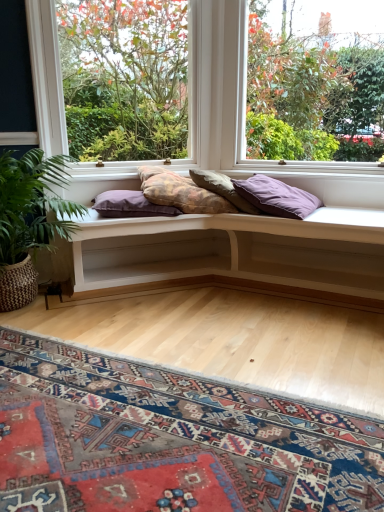
How much space does purple matte pillow at center, marked as the fourth pillow in a left-to-right arrangement, occupy vertically?

13.36 inches.

The height and width of the screenshot is (512, 384). Identify the location of textured purple pillow at center, the third pillow positioned from the right. (180, 192).

Describe the element at coordinates (229, 257) in the screenshot. I see `white wood bench at center` at that location.

Identify the location of textured beige pillow at center, acting as the second pillow starting from the right. (222, 189).

Where is `purple matte pillow at center, acting as the first pillow starting from the right`? purple matte pillow at center, acting as the first pillow starting from the right is located at coordinates (276, 197).

Does purple matte pillow at center, acting as the first pillow starting from the right, touch clear glass window at center, which is the 2th window in right-to-left order?

No.

Could you tell me if purple matte pillow at center, acting as the first pillow starting from the right, is facing clear glass window at center, which is the 1th window in left-to-right order?

No.

Would you say purple matte pillow at center, marked as the fourth pillow in a left-to-right arrangement, is outside clear glass window at center, which is the 1th window in left-to-right order?

purple matte pillow at center, marked as the fourth pillow in a left-to-right arrangement, lies outside clear glass window at center, which is the 1th window in left-to-right order,'s area.

Who is more distant, purple matte pillow at center, marked as the fourth pillow in a left-to-right arrangement, or clear glass window at center, which is the 1th window in left-to-right order?

clear glass window at center, which is the 1th window in left-to-right order, is behind.

Is point (99, 281) positioned after point (192, 426)?

Yes, it is behind point (192, 426).

Is white wood bench at center aimed at carpeted mat at lower center?

Yes, white wood bench at center faces towards carpeted mat at lower center.

Image resolution: width=384 pixels, height=512 pixels. I want to click on mat in front of the white wood bench at center, so click(x=169, y=440).

Which object is wider, white wood bench at center or carpeted mat at lower center?

carpeted mat at lower center is wider.

From the picture: From the image's perspective, is textured purple pillow at center, the third pillow positioned from the right, located beneath white wood bench at center?

No, from the image's perspective, textured purple pillow at center, the third pillow positioned from the right, is not beneath white wood bench at center.

Is textured purple pillow at center, the third pillow positioned from the right, oriented towards white wood bench at center?

No, textured purple pillow at center, the third pillow positioned from the right, is not oriented towards white wood bench at center.

Would you say textured purple pillow at center, which ranks as the 2th pillow in left-to-right order, is to the left or to the right of white wood bench at center in the picture?

Clearly, textured purple pillow at center, which ranks as the 2th pillow in left-to-right order, is on the left of white wood bench at center in the image.

Measure the distance from textured purple pillow at center, which ranks as the 2th pillow in left-to-right order, to white wood bench at center.

15.96 inches.

Considering the sizes of clear glass window at center, which is the 1th window in left-to-right order, and carpeted mat at lower center in the image, is clear glass window at center, which is the 1th window in left-to-right order, bigger or smaller than carpeted mat at lower center?

Clearly, clear glass window at center, which is the 1th window in left-to-right order, is larger in size than carpeted mat at lower center.

How far apart are clear glass window at center, which is the 1th window in left-to-right order, and carpeted mat at lower center?

A distance of 3.91 meters exists between clear glass window at center, which is the 1th window in left-to-right order, and carpeted mat at lower center.

How different are the orientations of clear glass window at center, which is the 1th window in left-to-right order, and carpeted mat at lower center in degrees?

40.9 degrees.

Between clear glass window at center, which is the 2th window in right-to-left order, and carpeted mat at lower center, which one appears on the right side from the viewer's perspective?

carpeted mat at lower center.

Considering the sizes of objects purple fabric pillow at center, the first pillow from the left, and white wood bench at center in the image provided, who is thinner, purple fabric pillow at center, the first pillow from the left, or white wood bench at center?

purple fabric pillow at center, the first pillow from the left.

Which is more distant, (158, 210) or (106, 229)?

The point (158, 210) is farther.

How many degrees apart are the facing directions of purple fabric pillow at center, placed as the fourth pillow when sorted from right to left, and white wood bench at center?

purple fabric pillow at center, placed as the fourth pillow when sorted from right to left, and white wood bench at center are facing 35.8 degrees away from each other.

How distant is purple fabric pillow at center, the first pillow from the left, from white wood bench at center?

They are 18.09 inches apart.

From a real-world perspective, is textured beige pillow at center, acting as the second pillow starting from the right, positioned above or below purple matte pillow at center, acting as the first pillow starting from the right?

textured beige pillow at center, acting as the second pillow starting from the right, is above purple matte pillow at center, acting as the first pillow starting from the right.

From the image's perspective, is textured beige pillow at center, acting as the second pillow starting from the right, under purple matte pillow at center, acting as the first pillow starting from the right?

Actually, textured beige pillow at center, acting as the second pillow starting from the right, appears above purple matte pillow at center, acting as the first pillow starting from the right, in the image.

Who is taller, textured beige pillow at center, the 3th pillow when ordered from left to right, or purple matte pillow at center, marked as the fourth pillow in a left-to-right arrangement?

purple matte pillow at center, marked as the fourth pillow in a left-to-right arrangement, is taller.

Which is behind, point (233, 198) or point (269, 181)?

The point (269, 181) is farther from the camera.

Is white wood bench at center turned away from textured beige pillow at center, acting as the second pillow starting from the right?

white wood bench at center is not turned away from textured beige pillow at center, acting as the second pillow starting from the right.

I want to click on table below the textured beige pillow at center, acting as the second pillow starting from the right (from a real-world perspective), so click(229, 257).

From a real-world perspective, who is located lower, white wood bench at center or textured beige pillow at center, the 3th pillow when ordered from left to right?

white wood bench at center.

From the image's perspective, would you say white wood bench at center is positioned over textured beige pillow at center, the 3th pillow when ordered from left to right?

No.

Locate an element on the screen. The height and width of the screenshot is (512, 384). window on the left of the purple matte pillow at center, marked as the fourth pillow in a left-to-right arrangement is located at coordinates (46, 75).

You are a GUI agent. You are given a task and a screenshot of the screen. Output one action in this format:
    pyautogui.click(x=<x>, y=<y>)
    Task: Click on the table on the right of the carpeted mat at lower center
    The image size is (384, 512).
    Given the screenshot: What is the action you would take?
    pyautogui.click(x=229, y=257)

When comparing their distances from green leafy plant at lower left, does purple fabric pillow at center, placed as the fourth pillow when sorted from right to left, or clear glass window at center, which is the 1th window in left-to-right order, seem further?

Based on the image, clear glass window at center, which is the 1th window in left-to-right order, appears to be further to green leafy plant at lower left.

When comparing their distances from textured purple pillow at center, which ranks as the 2th pillow in left-to-right order, does white wood bench at center or green leafy plant at lower left seem closer?

white wood bench at center lies closer to textured purple pillow at center, which ranks as the 2th pillow in left-to-right order, than the other object.

Looking at the image, which one is located further to purple matte pillow at center, acting as the first pillow starting from the right, clear glass window at center, which is the 1th window in left-to-right order, or clear glass window at upper right, the first window positioned from the right?

clear glass window at center, which is the 1th window in left-to-right order.

Which object lies nearer to the anchor point textured beige pillow at center, acting as the second pillow starting from the right, white wood bench at center or textured purple pillow at center, the third pillow positioned from the right?

textured purple pillow at center, the third pillow positioned from the right, is positioned closer to the anchor textured beige pillow at center, acting as the second pillow starting from the right.

From the picture: When comparing their distances from clear glass window at upper right, positioned as the second window in left-to-right order, does white wood bench at center or green leafy plant at lower left seem closer?

white wood bench at center is closer to clear glass window at upper right, positioned as the second window in left-to-right order.

Which object lies nearer to the anchor point green leafy plant at lower left, carpeted mat at lower center or white wood bench at center?

white wood bench at center is closer to green leafy plant at lower left.

Based on their spatial positions, is textured beige pillow at center, the 3th pillow when ordered from left to right, or clear glass window at upper right, positioned as the second window in left-to-right order, further from clear glass window at center, which is the 1th window in left-to-right order?

textured beige pillow at center, the 3th pillow when ordered from left to right, is further to clear glass window at center, which is the 1th window in left-to-right order.

From the picture: Which object lies further to the anchor point green leafy plant at lower left, textured beige pillow at center, the 3th pillow when ordered from left to right, or textured purple pillow at center, the third pillow positioned from the right?

Among the two, textured beige pillow at center, the 3th pillow when ordered from left to right, is located further to green leafy plant at lower left.

What are the coordinates of `pillow between textured purple pillow at center, the third pillow positioned from the right, and purple matte pillow at center, marked as the fourth pillow in a left-to-right arrangement, from left to right` in the screenshot? It's located at (222, 189).

Find the location of a particular element. The width and height of the screenshot is (384, 512). table between carpeted mat at lower center and purple matte pillow at center, marked as the fourth pillow in a left-to-right arrangement, from front to back is located at coordinates 229,257.

Where is `pillow between purple fabric pillow at center, the first pillow from the left, and textured beige pillow at center, the 3th pillow when ordered from left to right, in the horizontal direction`? This screenshot has height=512, width=384. pillow between purple fabric pillow at center, the first pillow from the left, and textured beige pillow at center, the 3th pillow when ordered from left to right, in the horizontal direction is located at coordinates (180, 192).

The height and width of the screenshot is (512, 384). In order to click on table between clear glass window at upper right, positioned as the second window in left-to-right order, and carpeted mat at lower center vertically in this screenshot , I will do `click(229, 257)`.